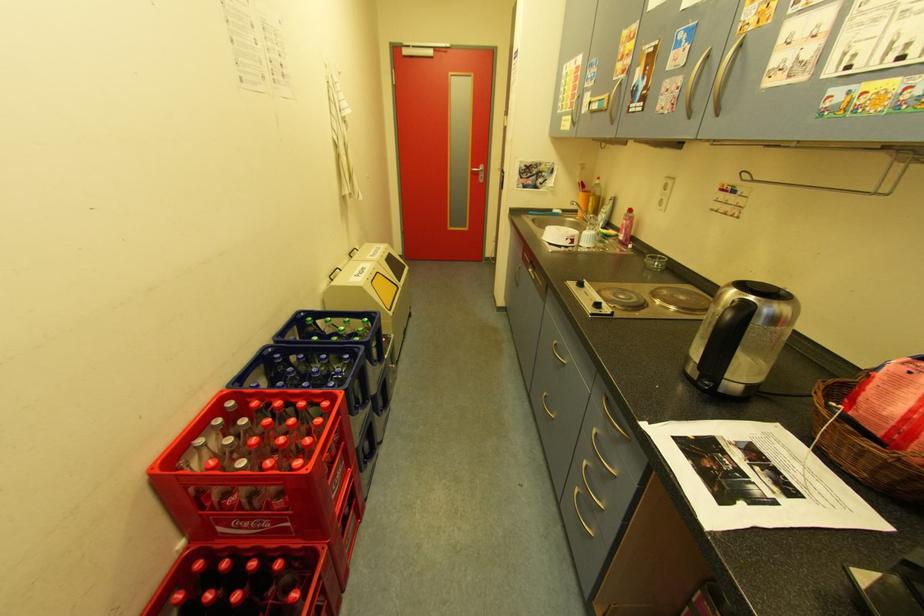
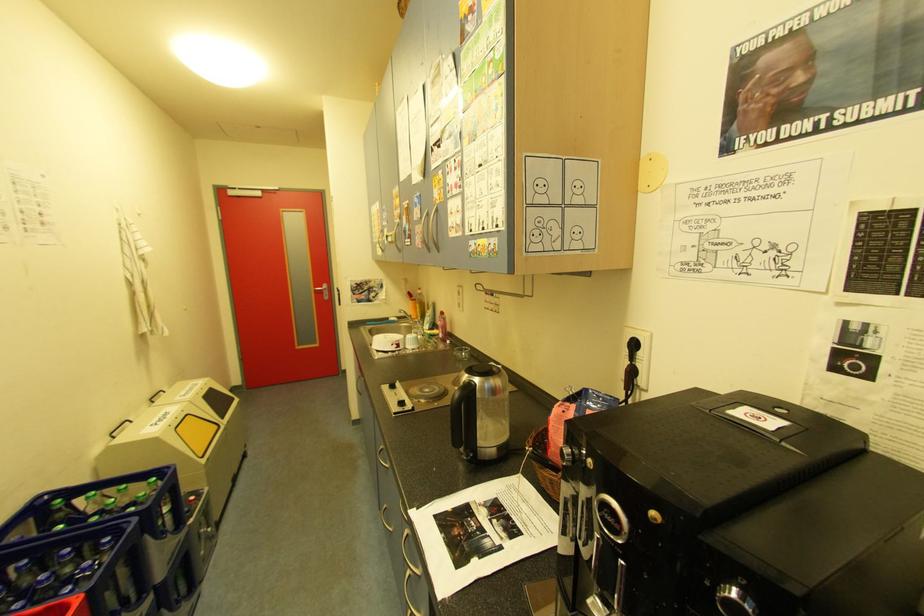
In a continuous first-person perspective shot, in which direction is the camera moving?

The cameraman walked toward right, backward.